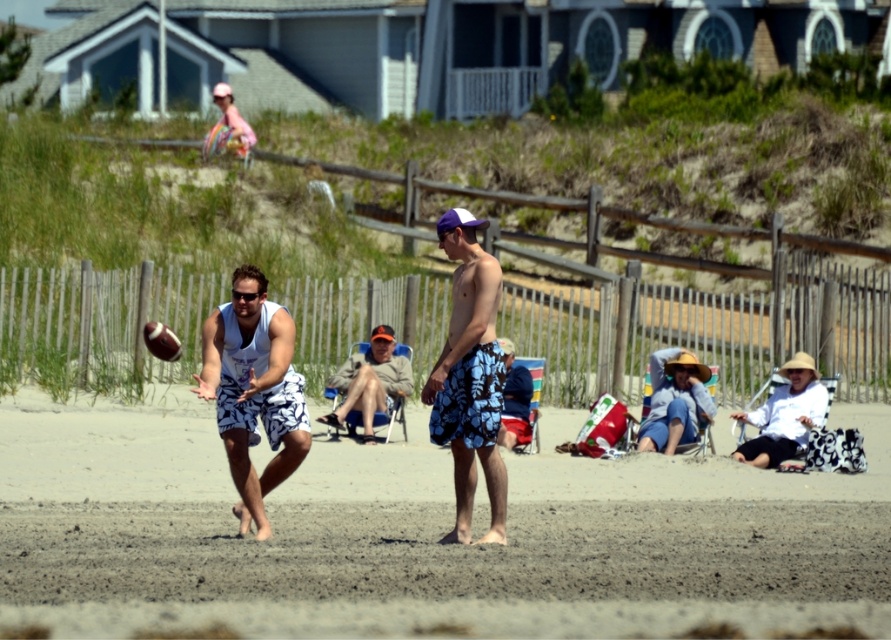
Question: Can you confirm if brown sandy beach at center is smaller than white printed shorts at center?

Choices:
 (A) yes
 (B) no

Answer: (B)

Question: Is brown sandy beach at center further to the viewer compared to blue floral shorts at center?

Choices:
 (A) no
 (B) yes

Answer: (A)

Question: Can you confirm if white printed shorts at center is smaller than blue floral shorts at center?

Choices:
 (A) yes
 (B) no

Answer: (B)

Question: Which object appears farthest from the camera in this image?

Choices:
 (A) brown sandy beach at center
 (B) khaki cotton shorts at center
 (C) matte blue shorts at center
 (D) blue floral shorts at center

Answer: (B)

Question: Which of these objects is positioned closest to the blue floral shorts at center?

Choices:
 (A) white printed shorts at center
 (B) matte blue shorts at center
 (C) brown sandy beach at center

Answer: (A)

Question: Among these objects, which one is farthest from the camera?

Choices:
 (A) brown sandy beach at center
 (B) khaki cotton shorts at center
 (C) blue floral shorts at center
 (D) white printed shorts at center

Answer: (B)